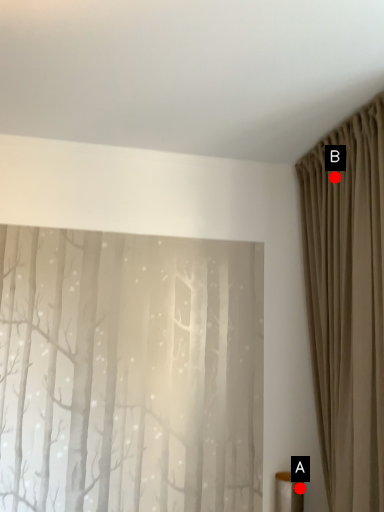
Question: Two points are circled on the image, labeled by A and B beside each circle. Which point is closer to the camera taking this photo?

Choices:
 (A) A is closer
 (B) B is closer

Answer: (B)